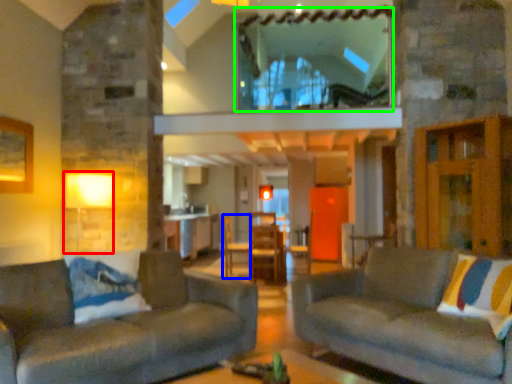
Question: Which object is positioned farthest from lamp (highlighted by a red box)? Select from armchair (highlighted by a blue box) and window (highlighted by a green box).

Choices:
 (A) armchair
 (B) window

Answer: (A)